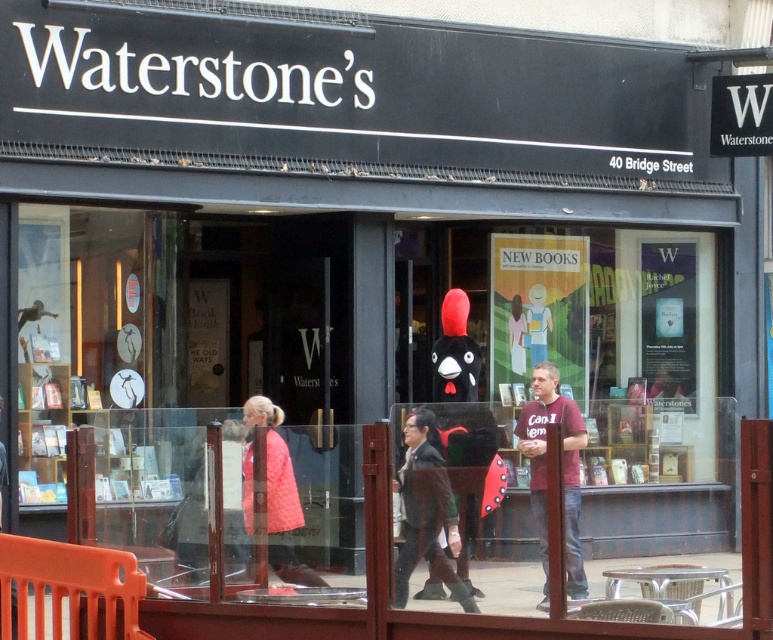
Question: Among these objects, which one is nearest to the camera?

Choices:
 (A) quilted pink coat at center
 (B) matte red t-shirt at center
 (C) dark brown leather jacket at center

Answer: (C)

Question: Observing the image, what is the correct spatial positioning of matte red t-shirt at center in reference to quilted pink coat at center?

Choices:
 (A) above
 (B) below

Answer: (A)

Question: Which of the following is the farthest from the observer?

Choices:
 (A) matte red t-shirt at center
 (B) quilted pink coat at center

Answer: (A)

Question: Which object appears farthest from the camera in this image?

Choices:
 (A) dark brown leather jacket at center
 (B) matte red t-shirt at center

Answer: (B)

Question: Is the position of dark brown leather jacket at center more distant than that of matte red t-shirt at center?

Choices:
 (A) no
 (B) yes

Answer: (A)

Question: Can you confirm if dark brown leather jacket at center is positioned to the left of matte red t-shirt at center?

Choices:
 (A) no
 (B) yes

Answer: (B)